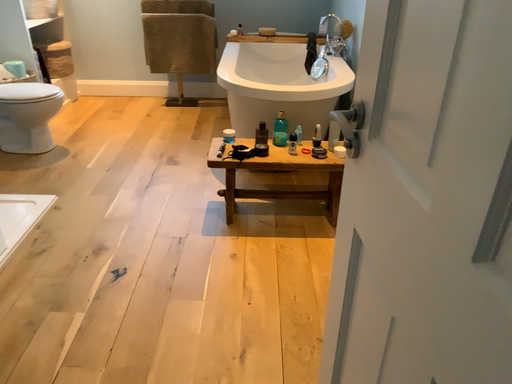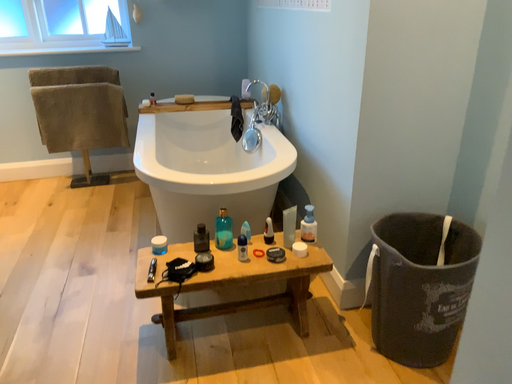
Question: How did the camera likely rotate when shooting the video?

Choices:
 (A) rotated right
 (B) rotated left

Answer: (A)